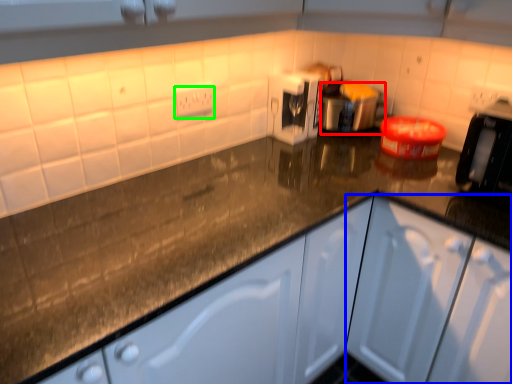
Question: Based on their relative distances, which object is nearer to appliance (highlighted by a red box)? Choose from cabinetry (highlighted by a blue box) and electric outlet (highlighted by a green box).

Choices:
 (A) cabinetry
 (B) electric outlet

Answer: (B)